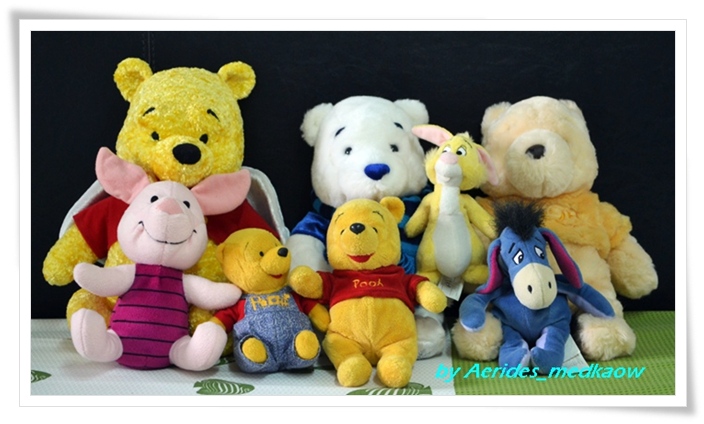
Find the location of a particular element. The image size is (704, 424). stuffed animals is located at coordinates (150, 284), (82, 221), (253, 274), (360, 257), (377, 150), (452, 192), (536, 262), (558, 146).